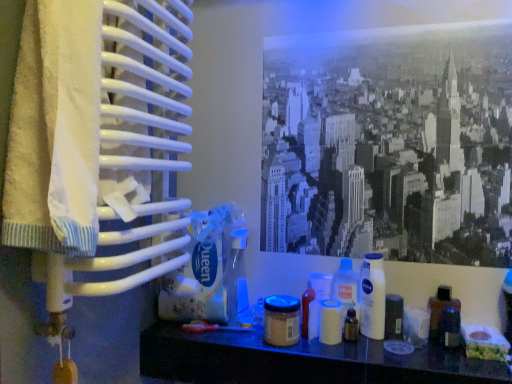
Find the location of a particular element. free space above matte plastic shelf at lower center (from a real-world perspective) is located at coordinates (330, 341).